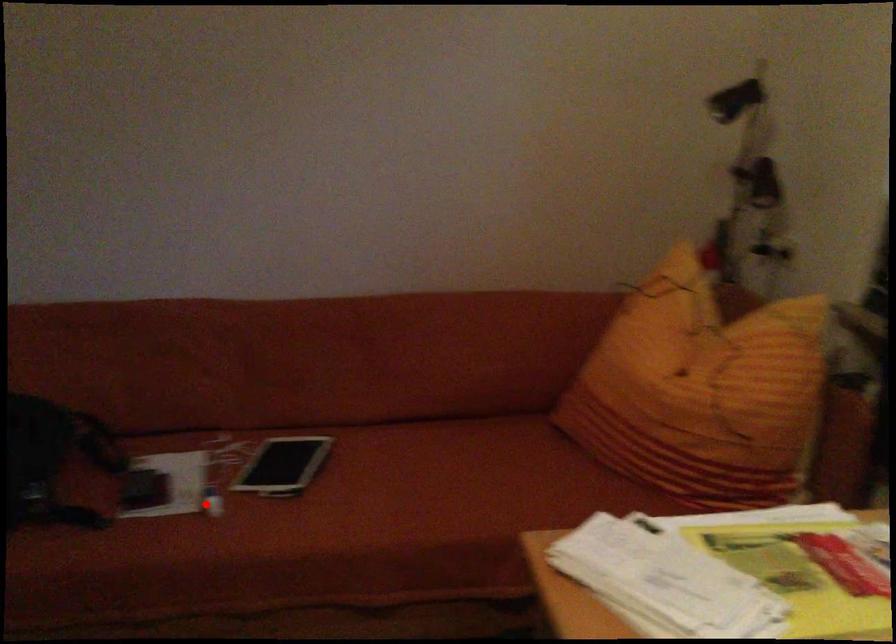
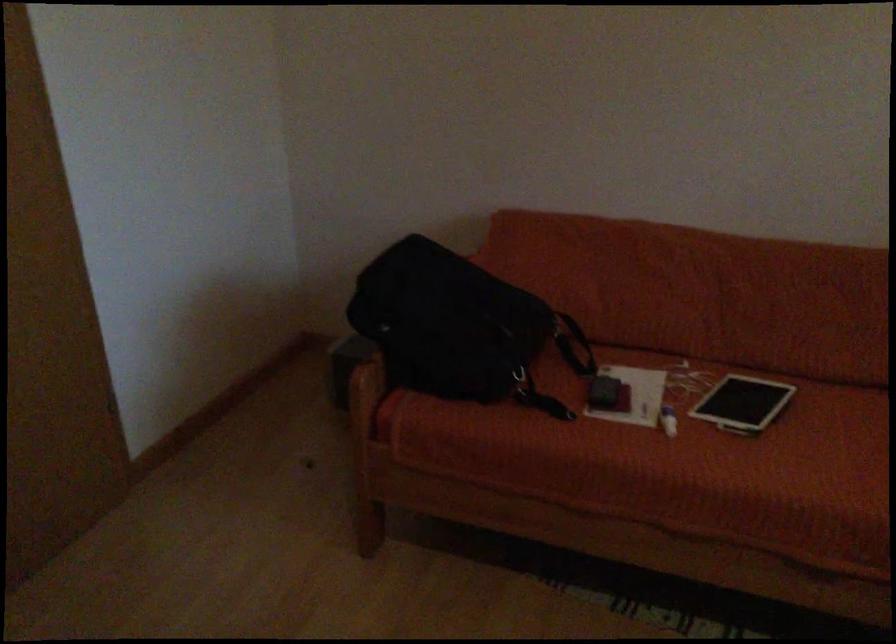
The point at the highlighted location is marked in the first image. Where is the corresponding point in the second image?

(668, 420)